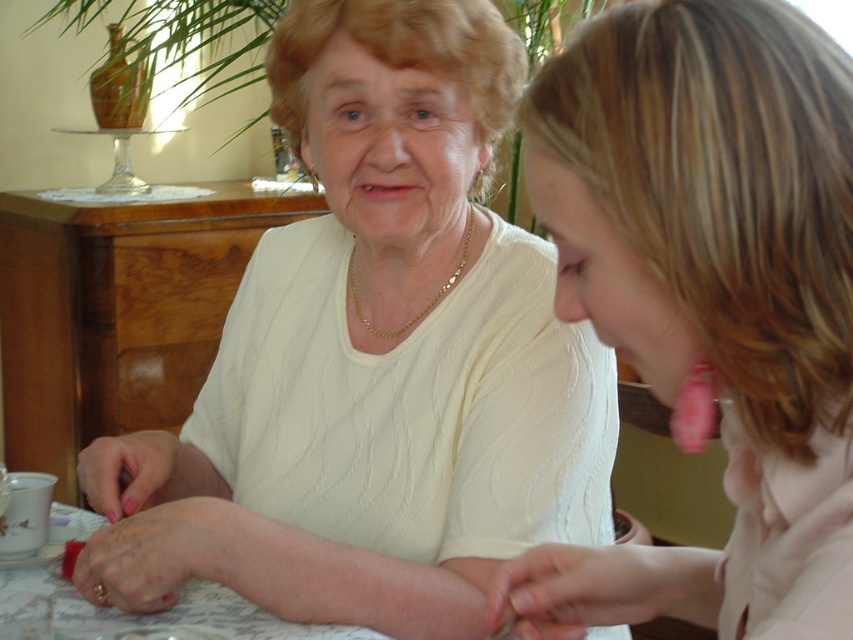
Question: Which point is farther to the camera?

Choices:
 (A) (735, 33)
 (B) (103, 627)

Answer: (B)

Question: Does pink fabric ear at upper right have a lesser width compared to white fabric table at lower left?

Choices:
 (A) yes
 (B) no

Answer: (A)

Question: Among these objects, which one is nearest to the camera?

Choices:
 (A) pink fabric ear at upper right
 (B) white fabric table at lower left
 (C) white knit sweater at center

Answer: (A)

Question: Considering the relative positions of white knit sweater at center and white fabric table at lower left in the image provided, where is white knit sweater at center located with respect to white fabric table at lower left?

Choices:
 (A) below
 (B) above

Answer: (B)

Question: Is pink fabric ear at upper right smaller than white fabric table at lower left?

Choices:
 (A) yes
 (B) no

Answer: (B)

Question: Which of the following is the farthest from the observer?

Choices:
 (A) pink fabric ear at upper right
 (B) white knit sweater at center

Answer: (B)